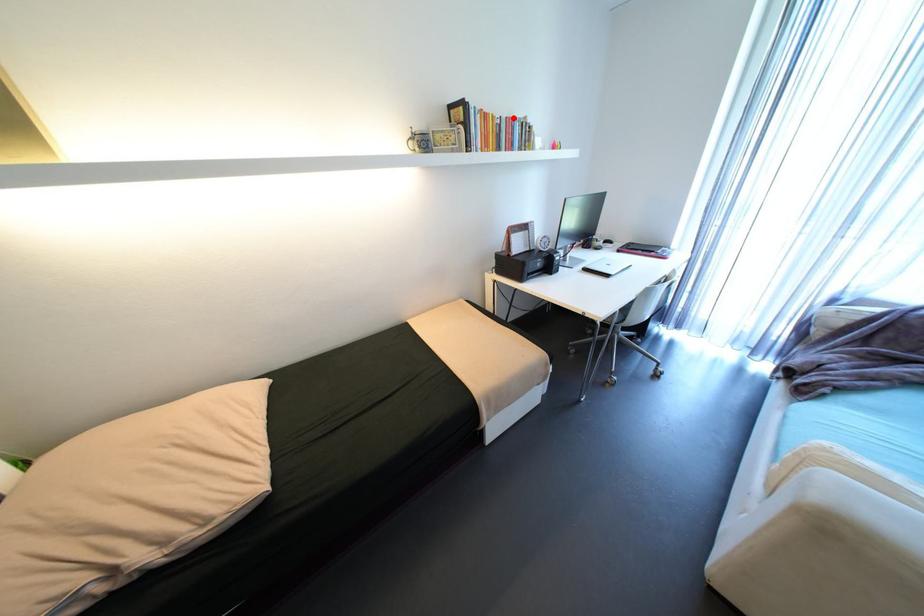
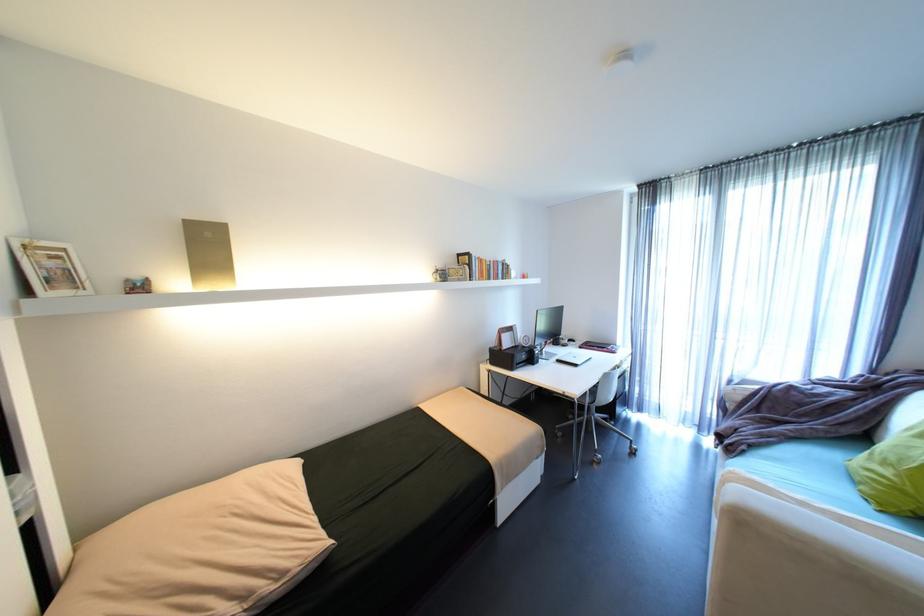
Question: I am providing you with two images of the same scene from different viewpoints. A red point is marked on the first image. Is the red point's position out of view in image 2?

Choices:
 (A) Yes
 (B) No

Answer: (B)